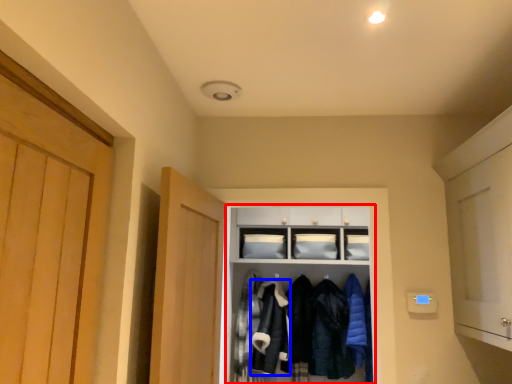
Question: Which of the following is the farthest to the observer, cabinetry (highlighted by a red box) or clothing (highlighted by a blue box)?

Choices:
 (A) cabinetry
 (B) clothing

Answer: (B)